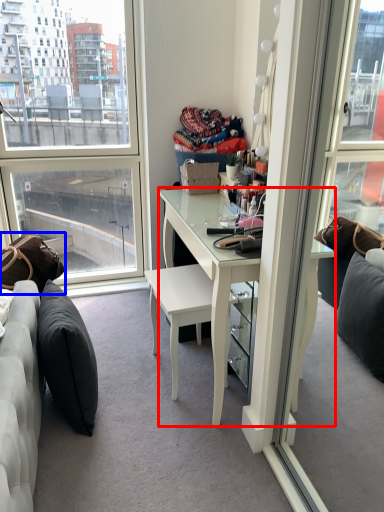
Question: Which of the following is the farthest to the observer, desk (highlighted by a red box) or pillow (highlighted by a blue box)?

Choices:
 (A) desk
 (B) pillow

Answer: (B)